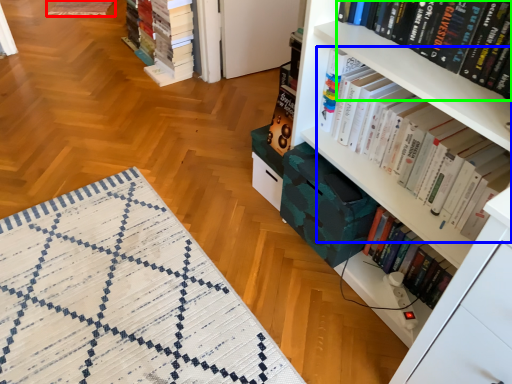
Question: Estimate the real-world distances between objects in this image. Which object is farther from quilt (highlighted by a red box), book (highlighted by a blue box) or book (highlighted by a green box)?

Choices:
 (A) book
 (B) book

Answer: (B)